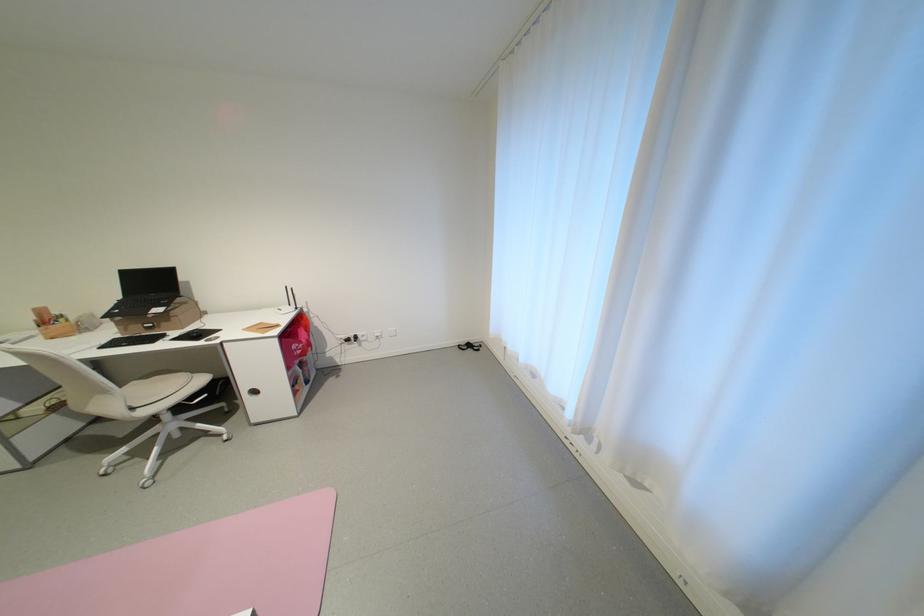
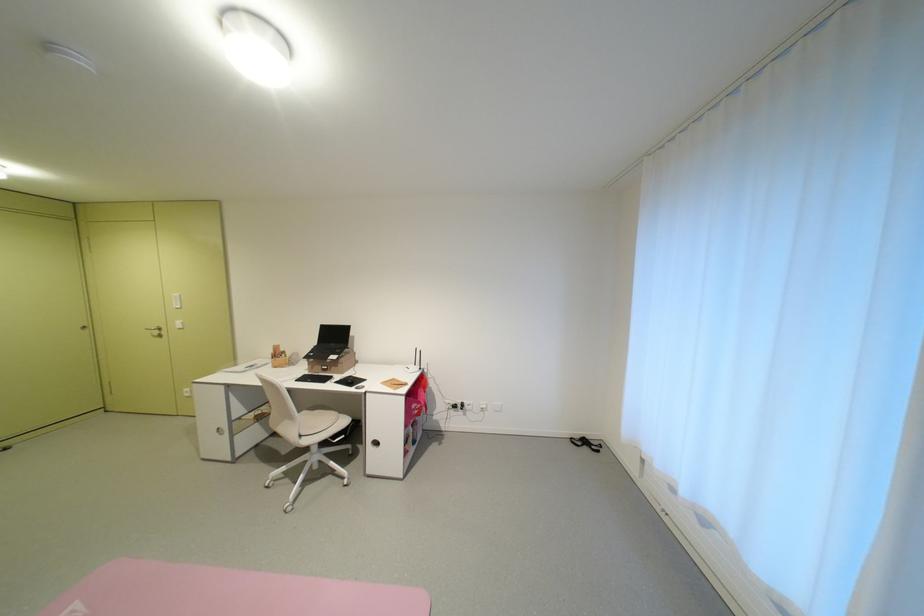
Question: In a continuous first-person perspective shot, in which direction is the camera moving?

Choices:
 (A) Left
 (B) Right
 (C) Forward
 (D) Backward

Answer: (A)